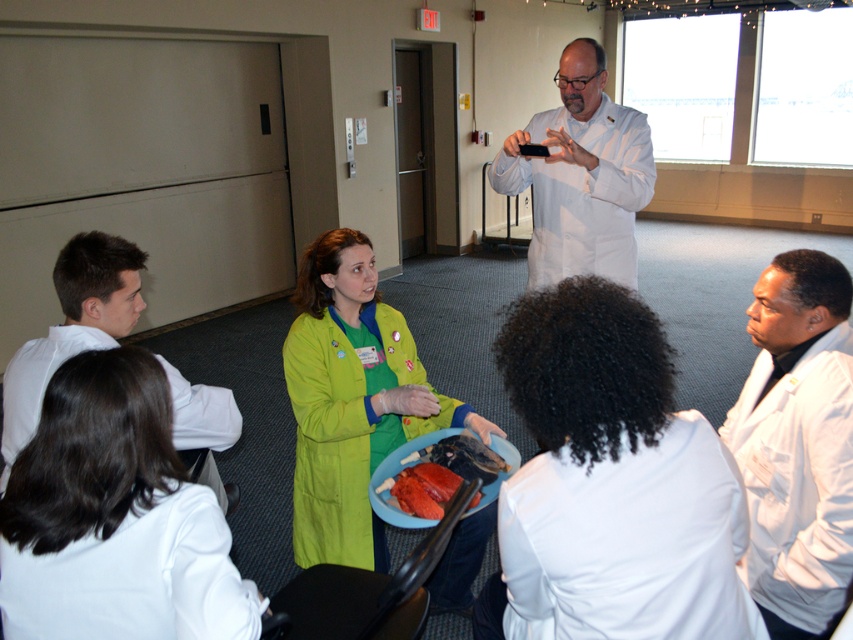
Is white matte coat at lower right shorter than white matte lab coat at upper center?

Correct, white matte coat at lower right is not as tall as white matte lab coat at upper center.

Consider the image. Is white matte coat at lower right bigger than white matte lab coat at upper center?

Actually, white matte coat at lower right might be smaller than white matte lab coat at upper center.

Is point (664, 429) closer to viewer compared to point (527, 184)?

That is True.

At what (x,y) coordinates should I click in order to perform the action: click on white matte coat at lower right. Please return your answer as a coordinate pair (x, y). The width and height of the screenshot is (853, 640). Looking at the image, I should click on (613, 481).

Does white matte coat at lower right have a larger size compared to shiny red meat at center?

Yes, white matte coat at lower right is bigger than shiny red meat at center.

Is point (537, 307) behind point (401, 461)?

That is False.

The image size is (853, 640). Identify the location of white matte coat at lower right. (613, 481).

Which is more to the left, matte green lab coat at lower left or white matte lab coat at upper center?

From the viewer's perspective, matte green lab coat at lower left appears more on the left side.

Does matte green lab coat at lower left have a lesser height compared to white matte lab coat at upper center?

Indeed, matte green lab coat at lower left has a lesser height compared to white matte lab coat at upper center.

Identify the location of matte green lab coat at lower left. The height and width of the screenshot is (640, 853). (114, 516).

Find the location of `matte green lab coat at lower left`. matte green lab coat at lower left is located at coordinates (114, 516).